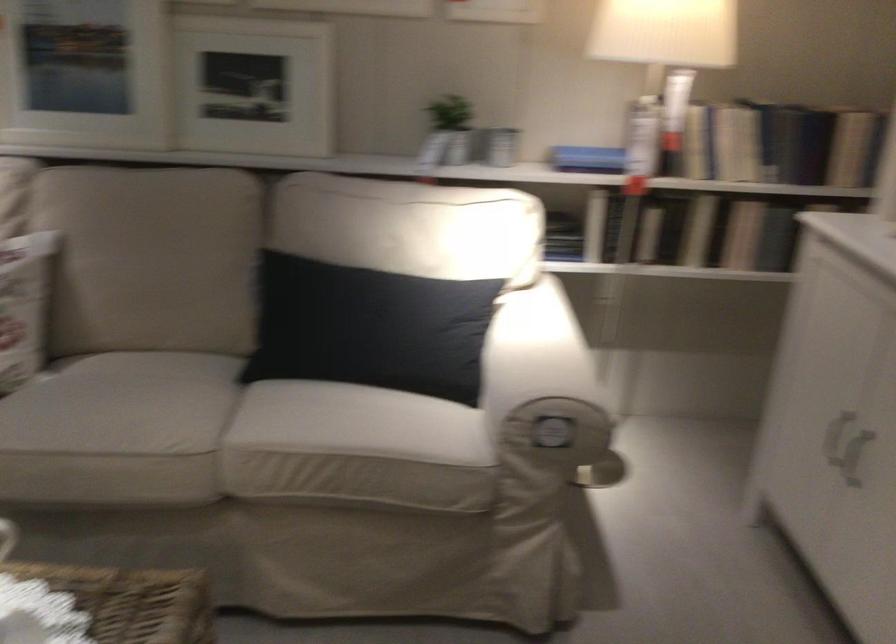
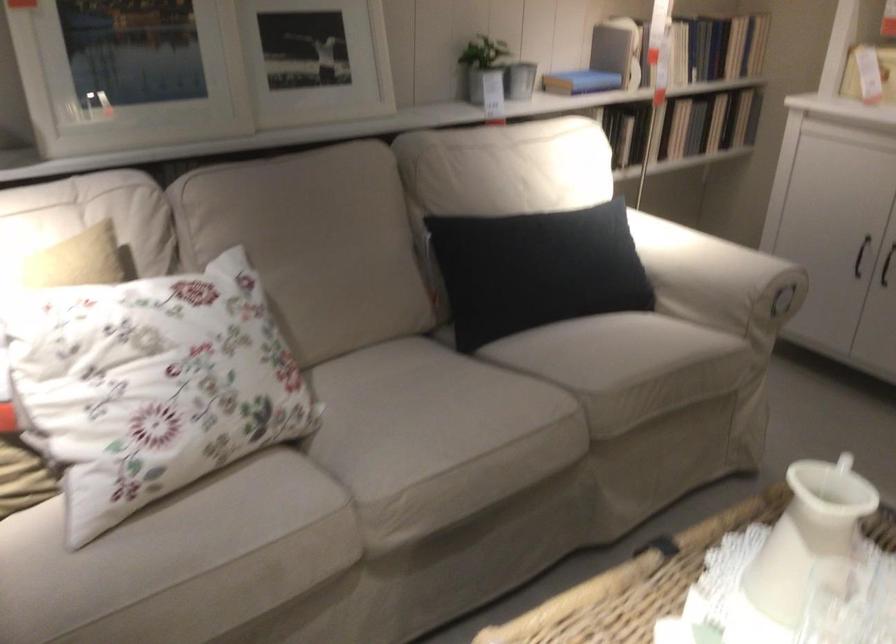
The point at (x=798, y=436) is marked in the first image. Where is the corresponding point in the second image?

(860, 256)